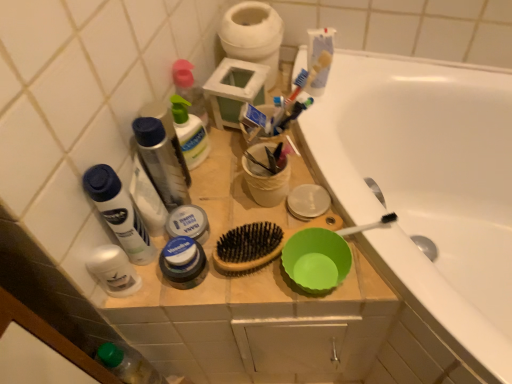
Question: Considering the relative positions of translucent plastic spray bottle at upper left, which is the first toiletry from top to bottom, and white matte toothpaste at center, the second toothpaste from the top, in the image provided, is translucent plastic spray bottle at upper left, which is the first toiletry from top to bottom, to the right of white matte toothpaste at center, the second toothpaste from the top, from the viewer's perspective?

Choices:
 (A) no
 (B) yes

Answer: (A)

Question: Does translucent plastic spray bottle at upper left, acting as the fifth toiletry starting from the bottom, have a greater height compared to white matte toothpaste at center, which is the first toothpaste in left-to-right order?

Choices:
 (A) yes
 (B) no

Answer: (A)

Question: Does translucent plastic spray bottle at upper left, acting as the fifth toiletry starting from the bottom, have a lesser height compared to white matte toothpaste at center, which is the first toothpaste in left-to-right order?

Choices:
 (A) yes
 (B) no

Answer: (B)

Question: From a real-world perspective, does translucent plastic spray bottle at upper left, acting as the fifth toiletry starting from the bottom, stand above white matte toothpaste at center, the first toothpaste from the bottom?

Choices:
 (A) yes
 (B) no

Answer: (A)

Question: Can you confirm if translucent plastic spray bottle at upper left, which is the first toiletry from top to bottom, is positioned to the left of white matte toothpaste at center, which is the first toothpaste in left-to-right order?

Choices:
 (A) no
 (B) yes

Answer: (B)

Question: Considering the relative sizes of translucent plastic spray bottle at upper left, acting as the fifth toiletry starting from the bottom, and white matte toothpaste at center, acting as the 2th toothpaste starting from the right, in the image provided, is translucent plastic spray bottle at upper left, acting as the fifth toiletry starting from the bottom, bigger than white matte toothpaste at center, acting as the 2th toothpaste starting from the right,?

Choices:
 (A) yes
 (B) no

Answer: (A)

Question: Is white ceramic bathtub at upper right aimed at translucent plastic mouthwash at upper left?

Choices:
 (A) no
 (B) yes

Answer: (A)

Question: From a real-world perspective, is white ceramic bathtub at upper right positioned over translucent plastic mouthwash at upper left based on gravity?

Choices:
 (A) no
 (B) yes

Answer: (A)

Question: Considering the relative sizes of white ceramic bathtub at upper right and translucent plastic mouthwash at upper left in the image provided, is white ceramic bathtub at upper right shorter than translucent plastic mouthwash at upper left?

Choices:
 (A) yes
 (B) no

Answer: (B)

Question: Are white ceramic bathtub at upper right and translucent plastic mouthwash at upper left beside each other?

Choices:
 (A) yes
 (B) no

Answer: (B)

Question: Is white ceramic bathtub at upper right outside translucent plastic mouthwash at upper left?

Choices:
 (A) yes
 (B) no

Answer: (A)

Question: Can you confirm if white ceramic bathtub at upper right is thinner than translucent plastic mouthwash at upper left?

Choices:
 (A) yes
 (B) no

Answer: (B)

Question: Can you confirm if white matte toilet paper at upper center is taller than translucent plastic mouthwash at upper left?

Choices:
 (A) no
 (B) yes

Answer: (A)